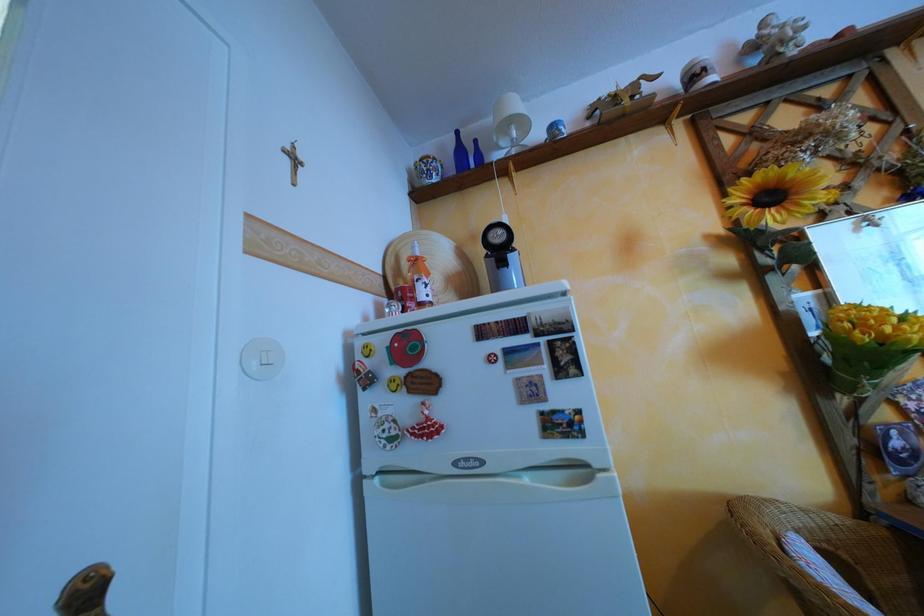
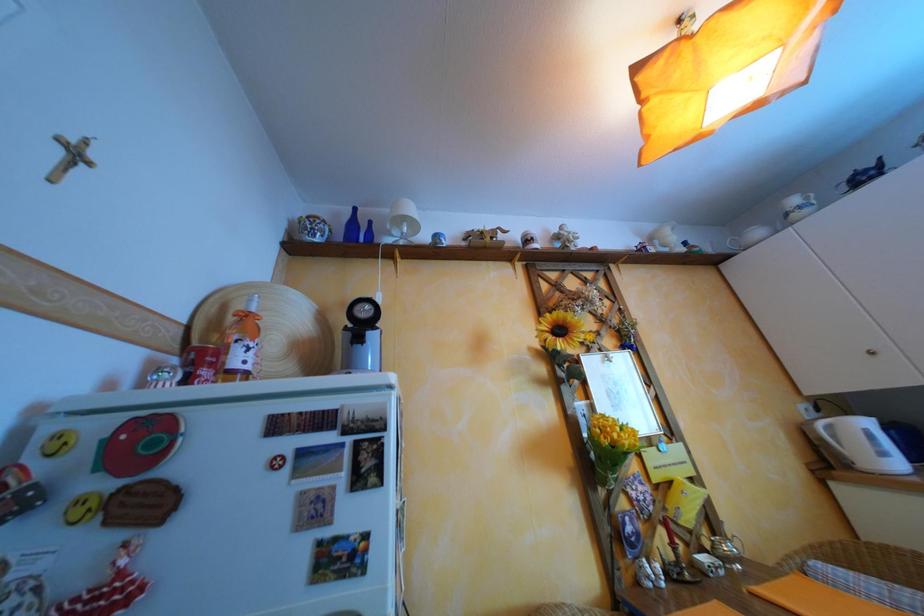
The images are taken continuously from a first-person perspective. In which direction is your viewpoint rotating?

The camera's rotation is toward right-up.